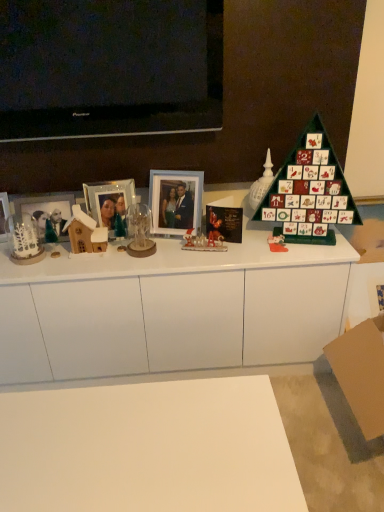
The height and width of the screenshot is (512, 384). What are the coordinates of `free space to the right of matte plastic advent calendar at right, which appears as the first toy when viewed from the right` in the screenshot? It's located at (316, 246).